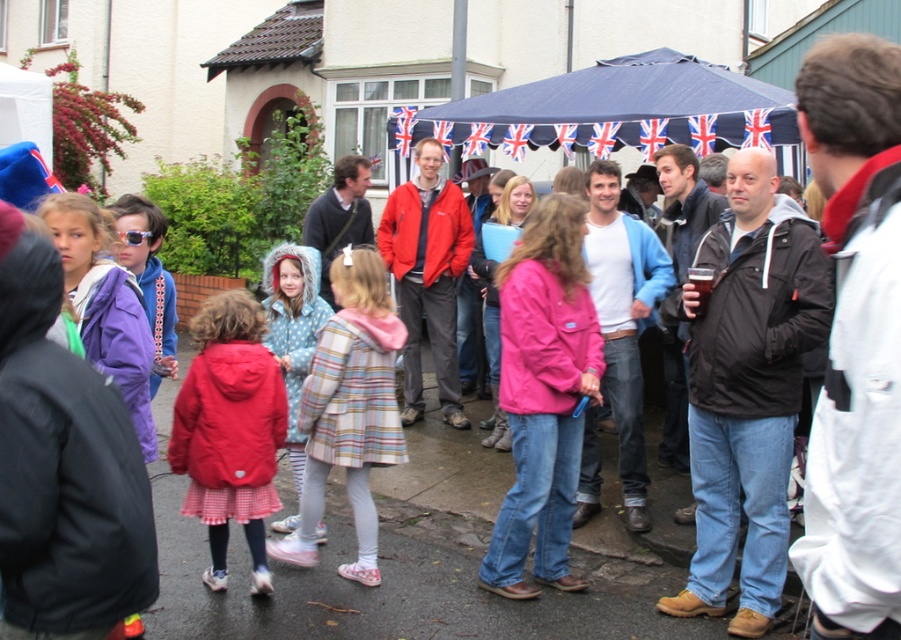
Is blue fabric canopy at center to the left of polka dot hooded coat at center from the viewer's perspective?

In fact, blue fabric canopy at center is to the right of polka dot hooded coat at center.

Does point (487, 134) come farther from viewer compared to point (296, 392)?

Yes, point (487, 134) is behind point (296, 392).

This screenshot has height=640, width=901. What are the coordinates of `blue fabric canopy at center` in the screenshot? It's located at pyautogui.click(x=620, y=109).

Locate an element on the screen. blue fabric canopy at center is located at coordinates (620, 109).

Which of these two, blue fabric canopy at center or matte red jacket at center, stands shorter?

With less height is blue fabric canopy at center.

Image resolution: width=901 pixels, height=640 pixels. Describe the element at coordinates (620, 109) in the screenshot. I see `blue fabric canopy at center` at that location.

Identify the location of blue fabric canopy at center. This screenshot has height=640, width=901. (620, 109).

Which is more to the left, matte red jacket at center or polka dot hooded coat at center?

matte red jacket at center

Who is more distant from viewer, (239, 502) or (299, 360)?

The point (299, 360) is more distant.

Is point (216, 420) less distant than point (301, 268)?

Yes, point (216, 420) is in front of point (301, 268).

The image size is (901, 640). I want to click on matte red jacket at center, so click(230, 429).